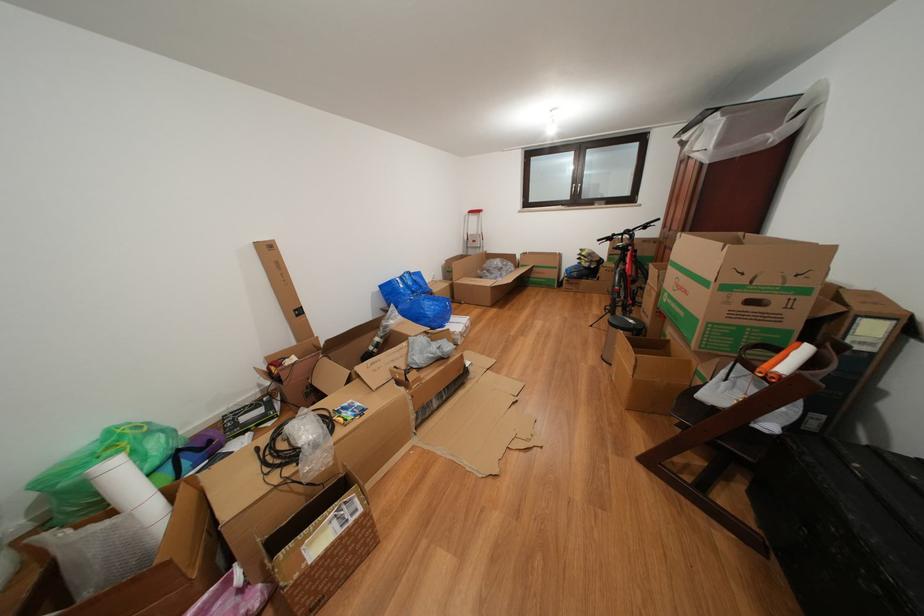
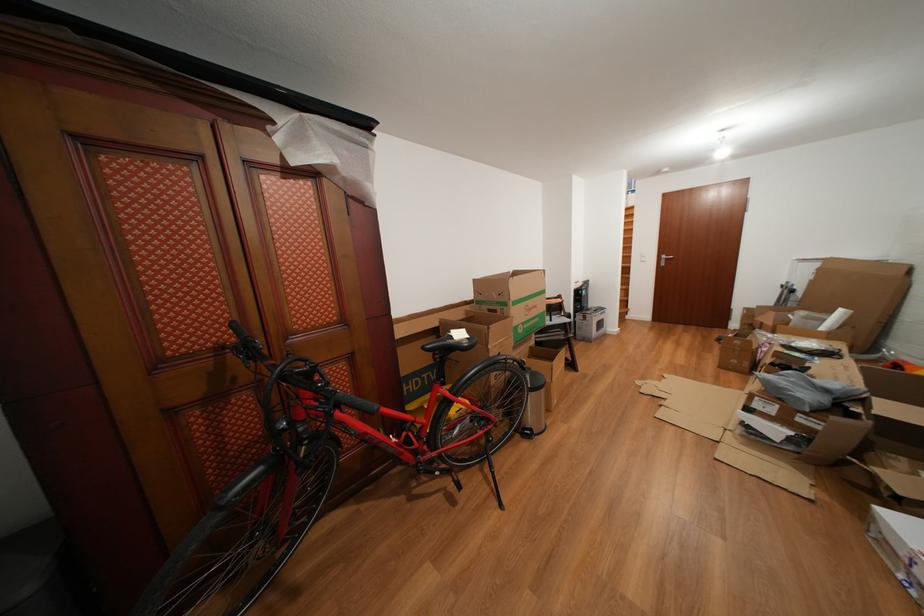
The point at (694, 297) is marked in the first image. Where is the corresponding point in the second image?

(543, 312)